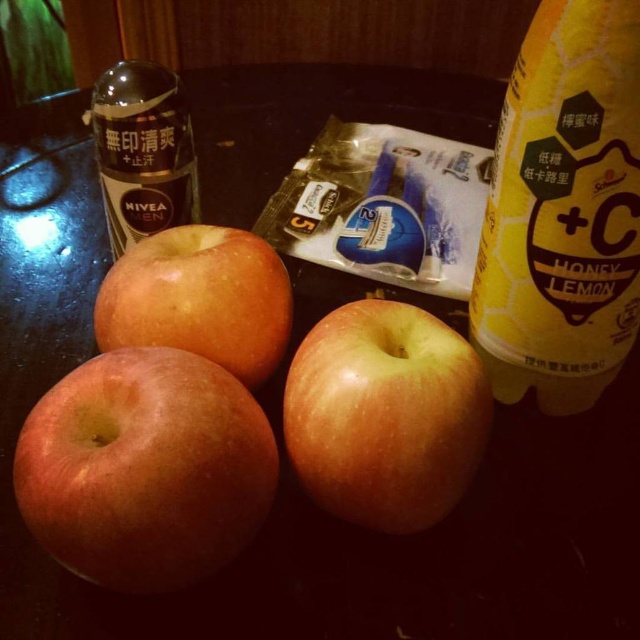
Question: Can you confirm if yellow matte apple at center is thinner than matte plastic bottle at upper left?

Choices:
 (A) no
 (B) yes

Answer: (A)

Question: Is yellow matte bottle at right wider than yellow matte apple at center?

Choices:
 (A) no
 (B) yes

Answer: (A)

Question: Does smooth golden apple at lower left have a lesser width compared to yellow matte apple at center?

Choices:
 (A) yes
 (B) no

Answer: (B)

Question: Which of the following is the farthest from the observer?

Choices:
 (A) (65, 458)
 (B) (131, 280)
 (C) (115, 112)

Answer: (C)

Question: Which point is closer to the camera taking this photo?

Choices:
 (A) (141, 452)
 (B) (148, 182)

Answer: (A)

Question: Which of the following is the farthest from the observer?

Choices:
 (A) matte plastic bottle at upper left
 (B) shiny golden apple at center
 (C) smooth golden apple at lower left

Answer: (A)